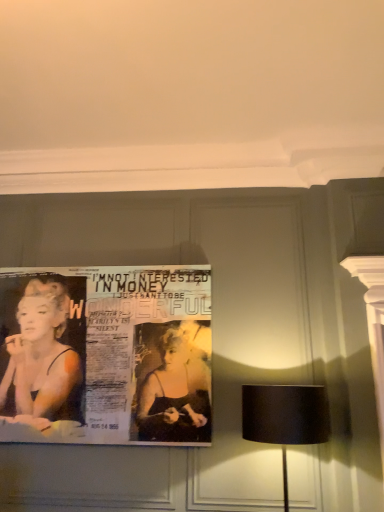
Find the location of a particular element. black fabric lampshade at right is located at coordinates (285, 418).

This screenshot has width=384, height=512. Describe the element at coordinates (285, 418) in the screenshot. I see `black fabric lampshade at right` at that location.

This screenshot has height=512, width=384. In order to click on matte paper poster at left in this screenshot , I will do `click(106, 355)`.

What do you see at coordinates (106, 355) in the screenshot? The height and width of the screenshot is (512, 384). I see `matte paper poster at left` at bounding box center [106, 355].

Find the location of a particular element. The image size is (384, 512). black fabric lampshade at right is located at coordinates (285, 418).

Based on their positions, is black fabric lampshade at right located to the left or right of matte paper poster at left?

From the image, it's evident that black fabric lampshade at right is to the right of matte paper poster at left.

Is black fabric lampshade at right in front of or behind matte paper poster at left in the image?

black fabric lampshade at right is positioned closer to the viewer than matte paper poster at left.

Does point (299, 390) lie behind point (135, 319)?

No, it is not.

Based on the photo, from the image's perspective, which one is positioned lower, black fabric lampshade at right or matte paper poster at left?

black fabric lampshade at right appears lower in the image.

From a real-world perspective, is black fabric lampshade at right on top of matte paper poster at left?

Incorrect, from a real-world perspective, black fabric lampshade at right is lower than matte paper poster at left.

Between black fabric lampshade at right and matte paper poster at left, which one has larger width?

black fabric lampshade at right is wider.

Is black fabric lampshade at right shorter than matte paper poster at left?

Yes.

Is black fabric lampshade at right bigger or smaller than matte paper poster at left?

In the image, black fabric lampshade at right appears to be larger than matte paper poster at left.

Is black fabric lampshade at right inside or outside of matte paper poster at left?

black fabric lampshade at right lies outside matte paper poster at left.

Are black fabric lampshade at right and matte paper poster at left located far from each other?

black fabric lampshade at right is positioned a significant distance from matte paper poster at left.

Could you tell me if black fabric lampshade at right is facing matte paper poster at left?

No, black fabric lampshade at right is not aimed at matte paper poster at left.

How many degrees apart are the facing directions of black fabric lampshade at right and matte paper poster at left?

The angular difference between black fabric lampshade at right and matte paper poster at left is 0.287 degrees.

Find the location of a particular element. poster behind the black fabric lampshade at right is located at coordinates (106, 355).

Considering the relative positions of matte paper poster at left and black fabric lampshade at right in the image provided, is matte paper poster at left to the right of black fabric lampshade at right from the viewer's perspective?

In fact, matte paper poster at left is to the left of black fabric lampshade at right.

Is matte paper poster at left further to the viewer compared to black fabric lampshade at right?

Yes, it is.

Does point (119, 287) come in front of point (308, 415)?

No, it is behind (308, 415).

From the image's perspective, who appears lower, matte paper poster at left or black fabric lampshade at right?

black fabric lampshade at right, from the image's perspective.

From a real-world perspective, is matte paper poster at left physically below black fabric lampshade at right?

No.

Which object is thinner, matte paper poster at left or black fabric lampshade at right?

matte paper poster at left.

In terms of height, does matte paper poster at left look taller or shorter compared to black fabric lampshade at right?

Considering their sizes, matte paper poster at left has more height than black fabric lampshade at right.

In terms of size, does matte paper poster at left appear bigger or smaller than black fabric lampshade at right?

Considering their sizes, matte paper poster at left takes up less space than black fabric lampshade at right.

Is matte paper poster at left surrounding black fabric lampshade at right?

Actually, black fabric lampshade at right is outside matte paper poster at left.

In the scene shown: Is the surface of matte paper poster at left in direct contact with black fabric lampshade at right?

No, matte paper poster at left is not next to black fabric lampshade at right.

Does matte paper poster at left turn towards black fabric lampshade at right?

No, matte paper poster at left is not turned towards black fabric lampshade at right.

How different are the orientations of matte paper poster at left and black fabric lampshade at right in degrees?

The facing directions of matte paper poster at left and black fabric lampshade at right are 0.287 degrees apart.

Where is `lamp located on the right of matte paper poster at left`? The width and height of the screenshot is (384, 512). lamp located on the right of matte paper poster at left is located at coordinates (285, 418).

I want to click on poster above the black fabric lampshade at right (from a real-world perspective), so click(x=106, y=355).

You are a GUI agent. You are given a task and a screenshot of the screen. Output one action in this format:
    pyautogui.click(x=<x>, y=<y>)
    Task: Click on the lamp located in front of the matte paper poster at left
    
    Given the screenshot: What is the action you would take?
    pyautogui.click(x=285, y=418)